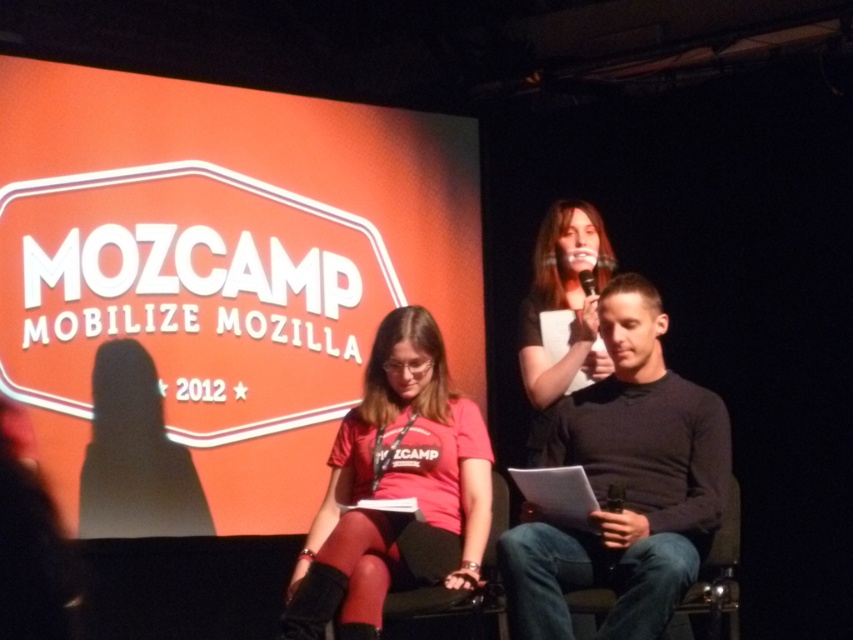
Question: Among these objects, which one is nearest to the camera?

Choices:
 (A) black matte shirt at center
 (B) matte red t-shirt at center

Answer: (A)

Question: Is matte black microphone at upper center further to camera compared to black plastic microphone at upper center?

Choices:
 (A) yes
 (B) no

Answer: (B)

Question: Which object appears farthest from the camera in this image?

Choices:
 (A) black matte shirt at center
 (B) matte black microphone at upper center

Answer: (B)

Question: Is matte black microphone at upper center thinner than black plastic microphone at upper center?

Choices:
 (A) no
 (B) yes

Answer: (A)

Question: Considering the relative positions of matte red t-shirt at center and denim fabric chair at center in the image provided, where is matte red t-shirt at center located with respect to denim fabric chair at center?

Choices:
 (A) left
 (B) right

Answer: (A)

Question: Which of the following is the closest to the observer?

Choices:
 (A) (737, 545)
 (B) (430, 358)

Answer: (A)